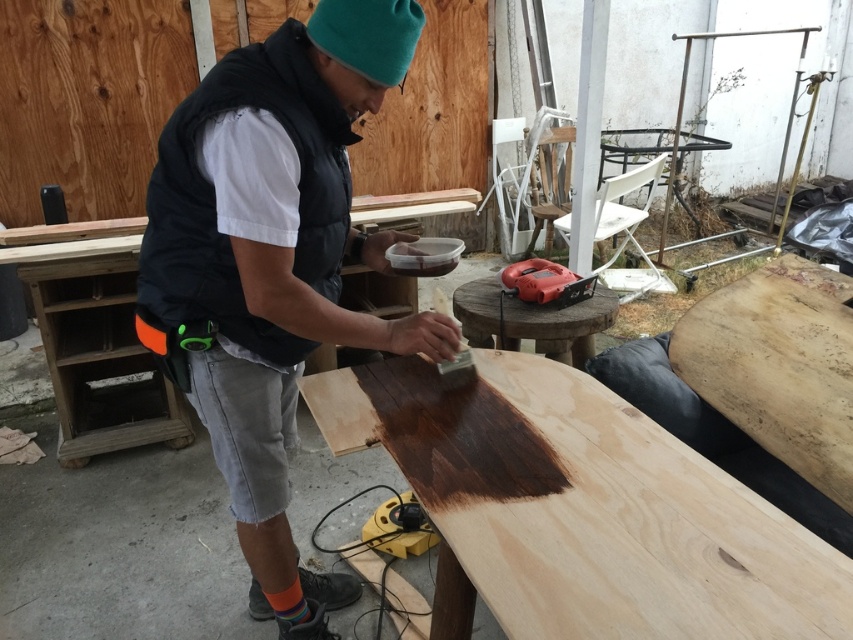
Question: Among these objects, which one is nearest to the camera?

Choices:
 (A) orange plastic power tool at center
 (B) natural wood plywood at lower right
 (C) matte black vest at center

Answer: (C)

Question: Can you confirm if matte black vest at center is bigger than orange plastic power tool at center?

Choices:
 (A) no
 (B) yes

Answer: (B)

Question: Can you confirm if dark stained wood at center is thinner than matte black vest at center?

Choices:
 (A) no
 (B) yes

Answer: (A)

Question: Which object appears closest to the camera in this image?

Choices:
 (A) dark stained wood at center
 (B) matte black vest at center
 (C) orange plastic power tool at center

Answer: (A)

Question: Which of the following is the closest to the observer?

Choices:
 (A) natural wood plywood at lower right
 (B) orange plastic power tool at center
 (C) matte black vest at center

Answer: (C)

Question: Is matte black vest at center bigger than orange plastic power tool at center?

Choices:
 (A) no
 (B) yes

Answer: (B)